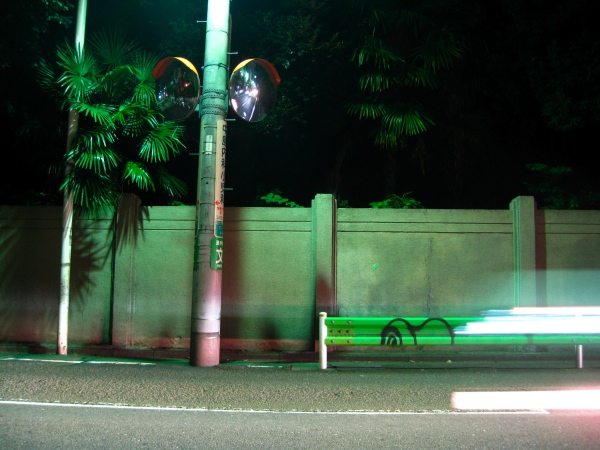
At what (x,y) coordinates should I click in order to perform the action: click on concrete wall. Please return your answer as a coordinate pair (x, y). The height and width of the screenshot is (450, 600). Looking at the image, I should click on (369, 261).